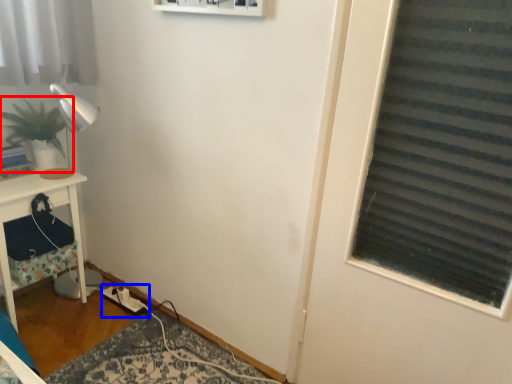
Question: Which object appears closest to the camera in this image, houseplant (highlighted by a red box) or extension cord (highlighted by a blue box)?

Choices:
 (A) houseplant
 (B) extension cord

Answer: (A)